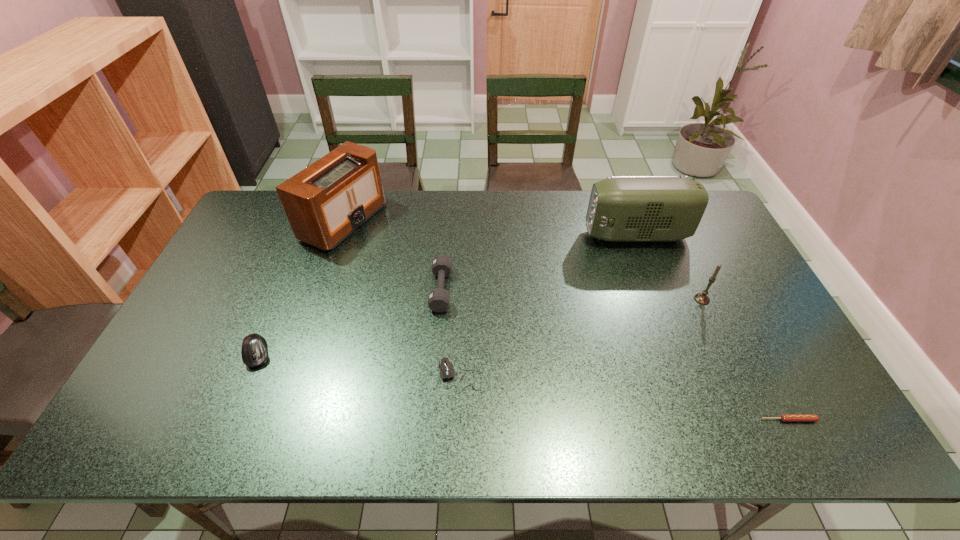
Where is `radio_receiver located at the right edge`? Image resolution: width=960 pixels, height=540 pixels. radio_receiver located at the right edge is located at coordinates (621, 208).

Find the location of `candle that is at the right edge`. candle that is at the right edge is located at coordinates (702, 298).

Where is `sausage that is at the right edge`? sausage that is at the right edge is located at coordinates point(784,417).

Identify the location of object present at the far right corner. This screenshot has width=960, height=540. (621, 208).

The height and width of the screenshot is (540, 960). Identify the location of object positioned at the near right corner. (784, 417).

Locate an element on the screen. The height and width of the screenshot is (540, 960). vacant space at the far edge is located at coordinates (536, 207).

You are a GUI agent. You are given a task and a screenshot of the screen. Output one action in this format:
    pyautogui.click(x=<x>, y=<y>)
    Task: Click on the blank space at the left edge of the desktop
    Image resolution: width=960 pixels, height=540 pixels.
    Given the screenshot: What is the action you would take?
    pyautogui.click(x=252, y=305)

Find the location of `vacant region at the right edge of the desktop`. vacant region at the right edge of the desktop is located at coordinates (716, 238).

The width and height of the screenshot is (960, 540). Find the location of `vacant space at the far right corner`. vacant space at the far right corner is located at coordinates (708, 221).

Find the location of a particular element. free point between the third shortest object and the left radio_receiver is located at coordinates (300, 287).